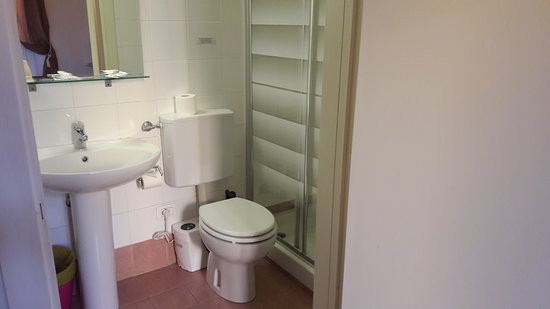
Identify the location of sink. (100, 179), (93, 235).